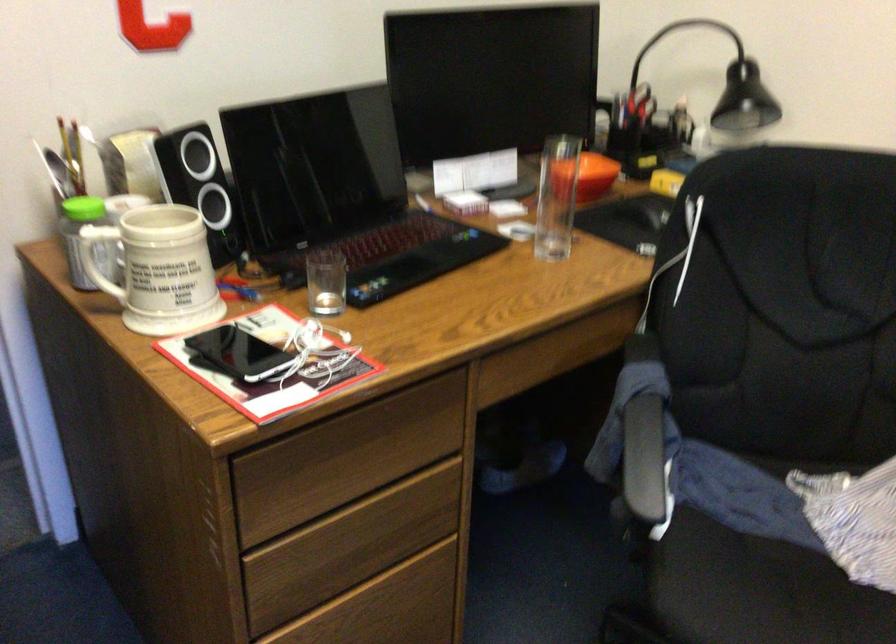
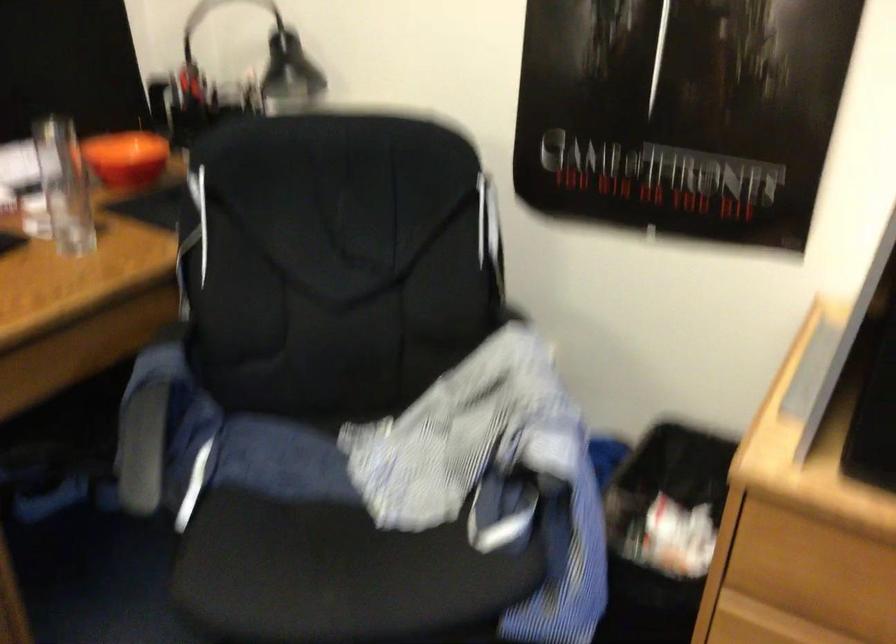
The point at (636, 459) is marked in the first image. Where is the corresponding point in the second image?

(142, 448)